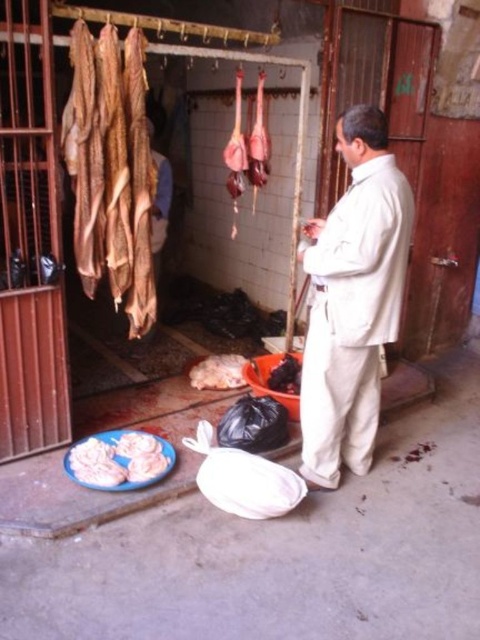
Based on the coordinates provided, what object is located at point (352, 300) in the scene?

The point (352, 300) corresponds to the light beige suit at center.